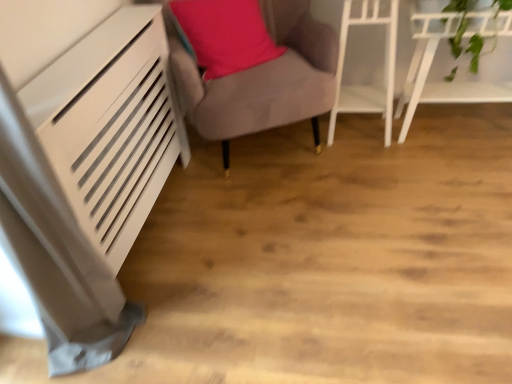
Locate an element on the screen. The width and height of the screenshot is (512, 384). vacant area that is in front of velvet grey armchair at center, which is counted as the first furniture, starting from the left is located at coordinates point(279,229).